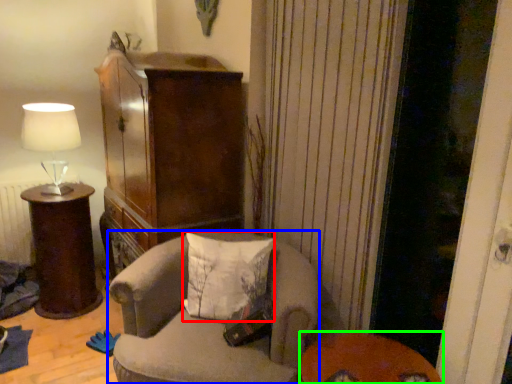
Question: Which object is the closest to the pillow (highlighted by a red box)? Choose among these: chair (highlighted by a blue box) or table (highlighted by a green box).

Choices:
 (A) chair
 (B) table

Answer: (A)